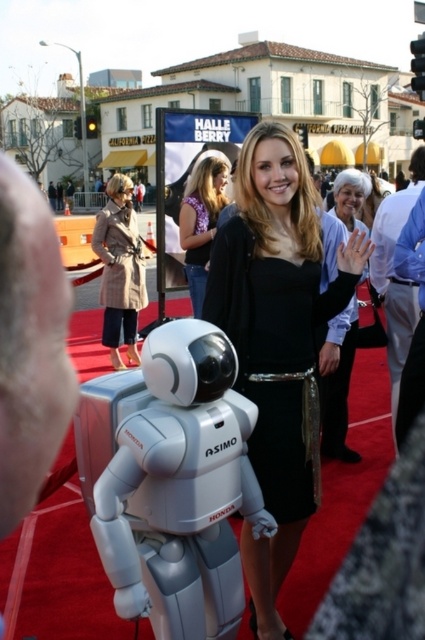
Question: Which point appears closest to the camera in this image?

Choices:
 (A) (42, 420)
 (B) (374, 266)
 (C) (112, 248)

Answer: (A)

Question: Which object is the farthest from the light blue shirt at center?

Choices:
 (A) plaid wool coat at left
 (B) matte black dress at center

Answer: (A)

Question: Which object is positioned farthest from the black satin dress at center?

Choices:
 (A) white matte robot at center
 (B) matte black dress at center
 (C) purple floral blouse at center
 (D) silver metallic robot at center

Answer: (C)

Question: Does black satin dress at center appear over purple floral blouse at center?

Choices:
 (A) yes
 (B) no

Answer: (B)

Question: Can you confirm if silver metallic robot at center is thinner than purple floral blouse at center?

Choices:
 (A) yes
 (B) no

Answer: (A)

Question: Does white matte robot at center have a smaller size compared to black satin dress at center?

Choices:
 (A) yes
 (B) no

Answer: (A)